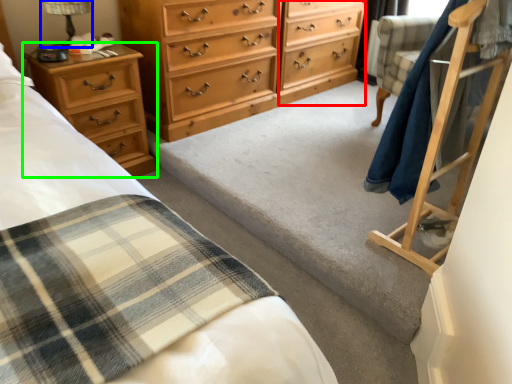
Question: Which object is positioned farthest from file cabinet (highlighted by a red box)? Select from table lamp (highlighted by a blue box) and chest of drawers (highlighted by a green box).

Choices:
 (A) table lamp
 (B) chest of drawers

Answer: (A)